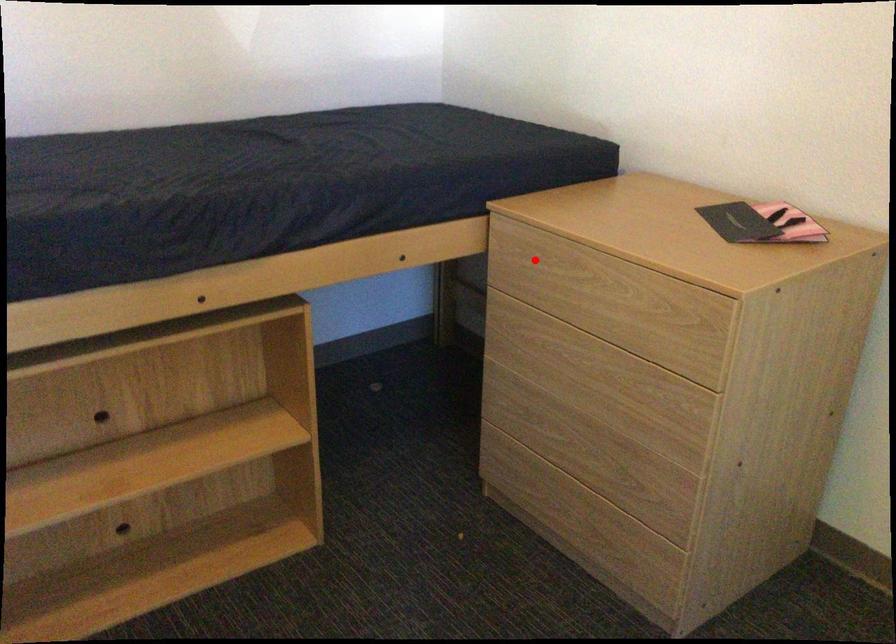
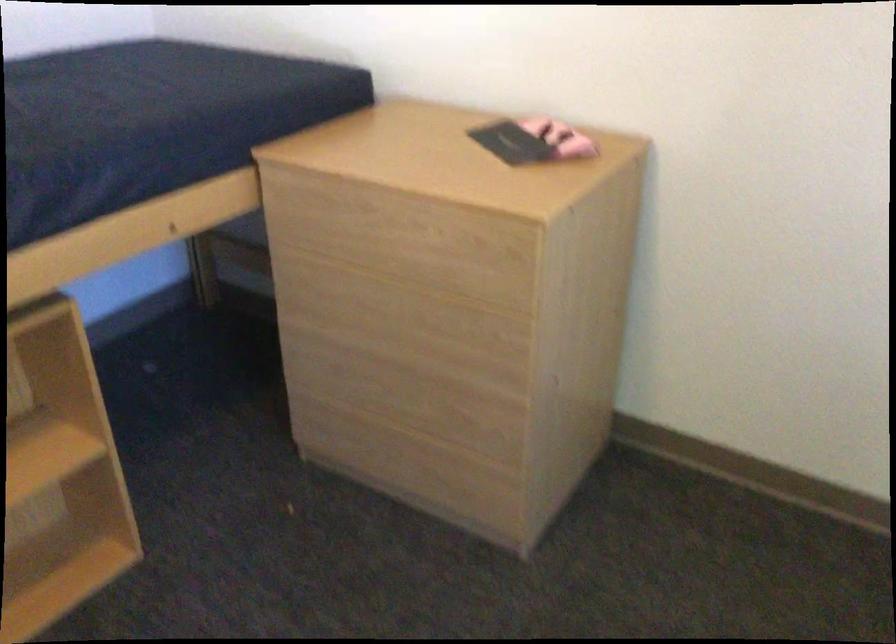
Where in the second image is the point corresponding to the highlighted location from the first image?

(324, 209)